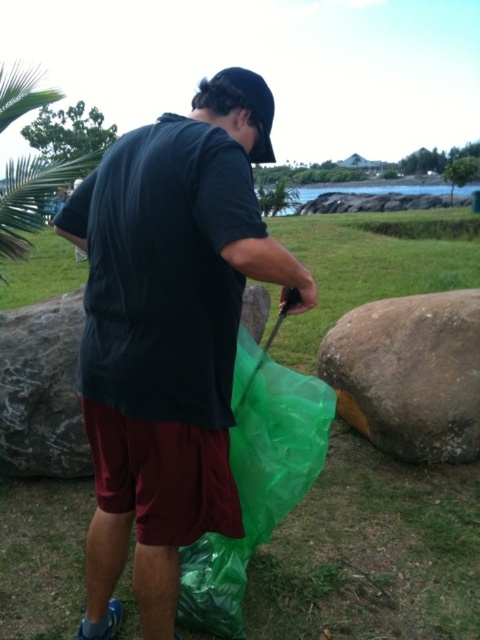
Question: Which point is farther from the camera taking this photo?

Choices:
 (A) click(x=396, y=266)
 (B) click(x=41, y=323)
 (C) click(x=252, y=84)
 (D) click(x=436, y=346)

Answer: (A)

Question: Estimate the real-world distances between objects in this image. Which object is farther from the black fabric baseball hat at upper center?

Choices:
 (A) green plastic bag at center
 (B) brown rough boulder at right
 (C) gray textured rock at left
 (D) matte black shirt at center

Answer: (A)

Question: Can you confirm if matte black shirt at center is wider than gray textured rock at left?

Choices:
 (A) yes
 (B) no

Answer: (A)

Question: Which of the following is the farthest from the observer?

Choices:
 (A) matte black shirt at center
 (B) green plastic bag at center
 (C) brown rough boulder at right
 (D) gray textured rock at left

Answer: (C)

Question: Observing the image, what is the correct spatial positioning of matte black shirt at center in reference to green plastic bag at center?

Choices:
 (A) above
 (B) below

Answer: (B)

Question: Does matte black shirt at center appear on the right side of green plastic bag at center?

Choices:
 (A) no
 (B) yes

Answer: (A)